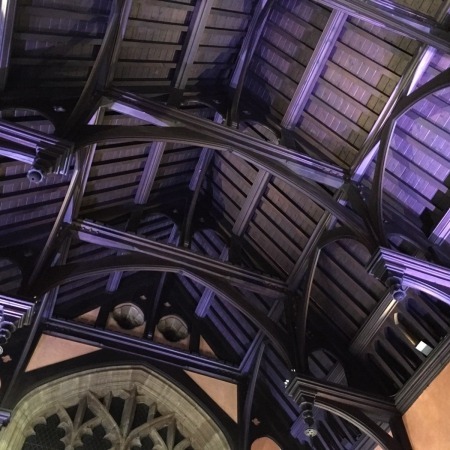
Identify the location of entry. Image resolution: width=450 pixels, height=450 pixels. coord(104,433).